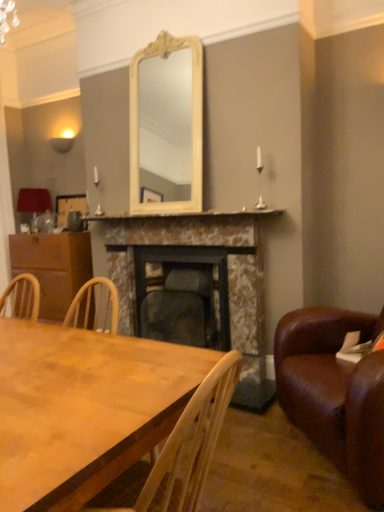
Question: Is marble fireplace at center, the second fireplace viewed from the left, not inside matte red lampshade at left?

Choices:
 (A) yes
 (B) no

Answer: (A)

Question: From the image's perspective, is marble fireplace at center, the first fireplace when ordered from right to left, over matte red lampshade at left?

Choices:
 (A) no
 (B) yes

Answer: (A)

Question: Is marble fireplace at center, the second fireplace viewed from the left, looking in the opposite direction of matte red lampshade at left?

Choices:
 (A) no
 (B) yes

Answer: (A)

Question: Are marble fireplace at center, the second fireplace viewed from the left, and matte red lampshade at left making contact?

Choices:
 (A) no
 (B) yes

Answer: (A)

Question: Is marble fireplace at center, the first fireplace when ordered from right to left, positioned in front of matte red lampshade at left?

Choices:
 (A) yes
 (B) no

Answer: (A)

Question: From a real-world perspective, is marble fireplace at center, the first fireplace when ordered from right to left, physically located above or below marble mantelpiece at center?

Choices:
 (A) below
 (B) above

Answer: (A)

Question: From the image's perspective, is marble fireplace at center, the first fireplace when ordered from right to left, located above or below marble mantelpiece at center?

Choices:
 (A) below
 (B) above

Answer: (A)

Question: Considering the positions of point (147, 274) and point (196, 212), is point (147, 274) closer or farther from the camera than point (196, 212)?

Choices:
 (A) closer
 (B) farther

Answer: (B)

Question: Considering the positions of marble fireplace at center, the second fireplace viewed from the left, and marble mantelpiece at center in the image, is marble fireplace at center, the second fireplace viewed from the left, taller or shorter than marble mantelpiece at center?

Choices:
 (A) short
 (B) tall

Answer: (B)

Question: From the image's perspective, is wooden picture frame at left positioned above or below brown wood cabinet at left?

Choices:
 (A) below
 (B) above

Answer: (B)

Question: Is wooden picture frame at left inside the boundaries of brown wood cabinet at left, or outside?

Choices:
 (A) outside
 (B) inside

Answer: (A)

Question: Based on their sizes in the image, would you say wooden picture frame at left is bigger or smaller than brown wood cabinet at left?

Choices:
 (A) small
 (B) big

Answer: (A)

Question: From a real-world perspective, is wooden picture frame at left positioned above or below brown wood cabinet at left?

Choices:
 (A) above
 (B) below

Answer: (A)

Question: From the image's perspective, is marble mantelpiece at center above or below marble fireplace at center, the second fireplace viewed from the left?

Choices:
 (A) below
 (B) above

Answer: (B)

Question: Is marble mantelpiece at center spatially inside marble fireplace at center, the first fireplace when ordered from right to left, or outside of it?

Choices:
 (A) inside
 (B) outside

Answer: (B)